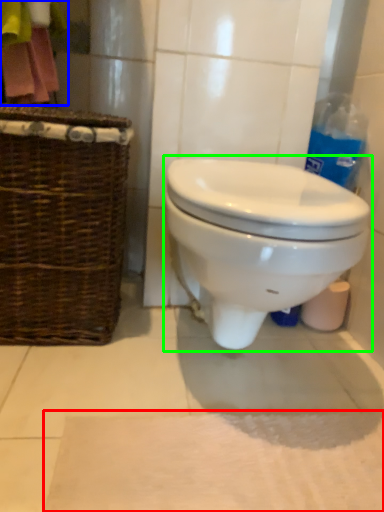
Question: Considering the real-world distances, which object is closest to bath mat (highlighted by a red box)? laundry (highlighted by a blue box) or toilet (highlighted by a green box).

Choices:
 (A) laundry
 (B) toilet

Answer: (B)